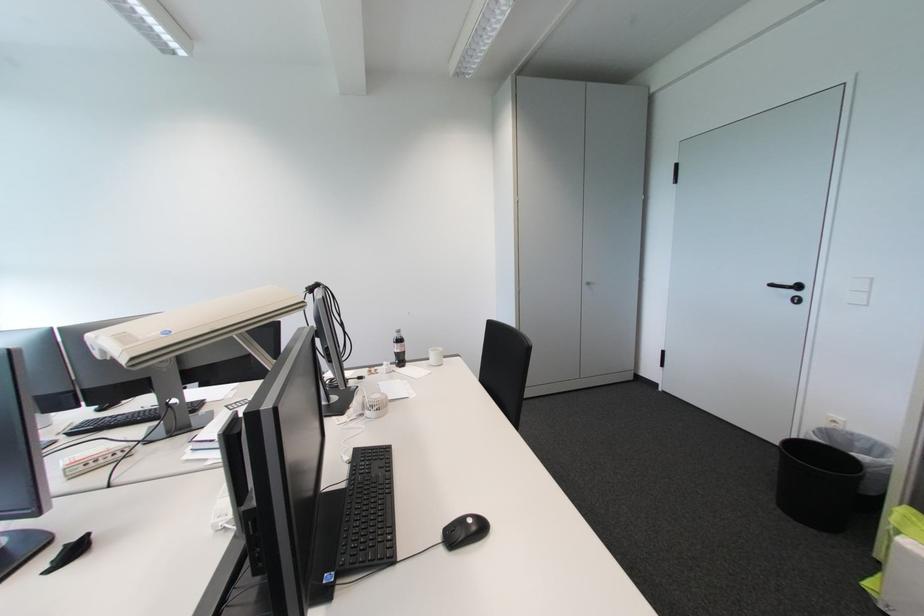
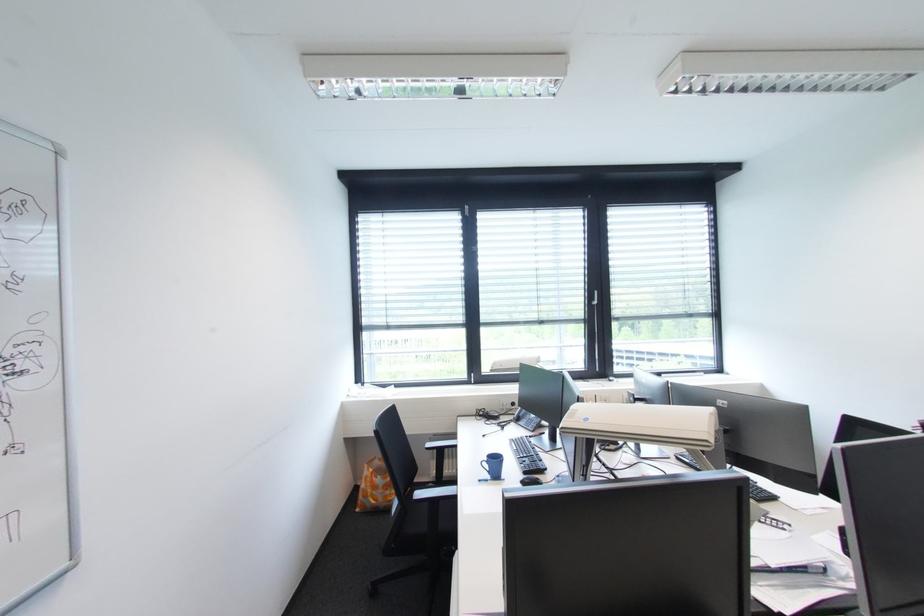
Question: The camera is either moving clockwise (left) or counter-clockwise (right) around the object. The first image is from the beginning of the video and the second image is from the end. Is the camera moving left or right when shooting the video?

Choices:
 (A) Left
 (B) Right

Answer: (B)